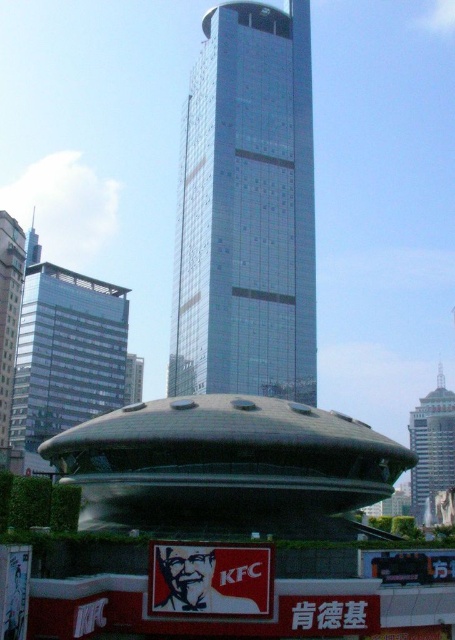
Where is `glassy metallic skyscraper at left`? Image resolution: width=455 pixels, height=640 pixels. glassy metallic skyscraper at left is located at coordinates (66, 353).

Is the position of glassy metallic skyscraper at left less distant than that of shiny silver tower at upper right?

No, it is not.

Is point (25, 369) closer to camera compared to point (414, 500)?

Yes, it is.

Locate an element on the screen. The width and height of the screenshot is (455, 640). glassy metallic skyscraper at left is located at coordinates pyautogui.click(x=66, y=353).

Measure the distance from shiny silver tower at upper right to glassy silver skyscraper at left.

129.13 meters

Is point (438, 428) positioned after point (11, 221)?

Yes, point (438, 428) is farther from viewer.

Who is more distant from viewer, (423,410) or (14,268)?

Point (423,410)

At what (x,y) coordinates should I click in order to perform the action: click on shiny silver tower at upper right. Please return your answer as a coordinate pair (x, y). The image size is (455, 640). Looking at the image, I should click on (431, 448).

You are a GUI agent. You are given a task and a screenshot of the screen. Output one action in this format:
    pyautogui.click(x=<x>, y=<y>)
    Task: Click on the glassy metallic skyscraper at center
    The width and height of the screenshot is (455, 640).
    Given the screenshot: What is the action you would take?
    pyautogui.click(x=247, y=211)

Does point (302, 202) lie in front of point (124, 360)?

Yes, it is.

Where is `glassy metallic skyscraper at center`? This screenshot has width=455, height=640. glassy metallic skyscraper at center is located at coordinates (247, 211).